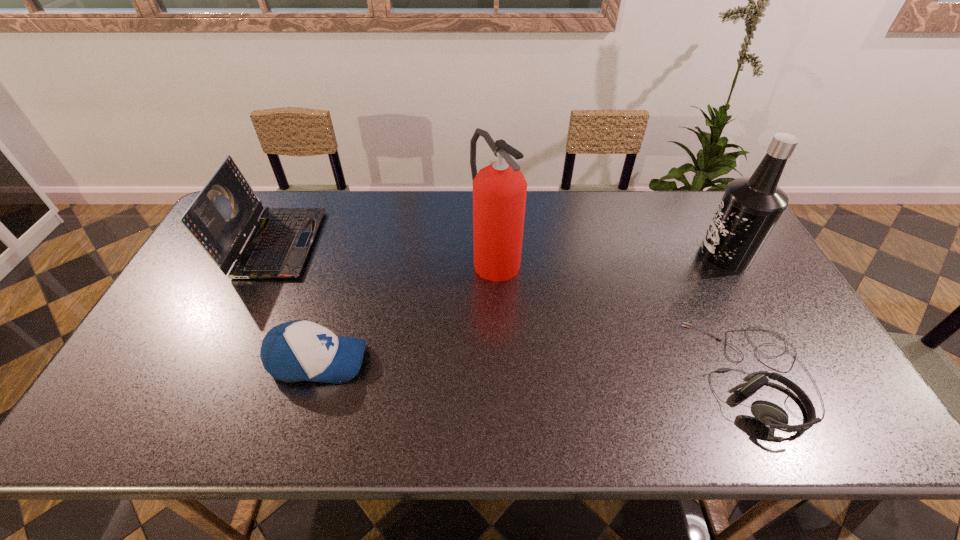
The height and width of the screenshot is (540, 960). I want to click on vacant space positioned on the front label of the liquor, so click(x=572, y=258).

Identify the location of blank space located on the screen of the leftmost object. (343, 243).

I want to click on free point located on the front-facing side of the baseball cap, so click(423, 361).

Find the location of a particular element. This screenshot has height=540, width=960. vacant space located on the outer surface of the headset is located at coordinates (631, 376).

Where is `free location located on the outer surface of the headset`? The height and width of the screenshot is (540, 960). free location located on the outer surface of the headset is located at coordinates (623, 376).

Identify the location of vacant space located on the outer surface of the headset. (614, 376).

Locate an element on the screen. This screenshot has width=960, height=540. fire extinguisher located at the far edge is located at coordinates (499, 190).

At what (x,y) coordinates should I click in order to perform the action: click on laptop computer present at the far edge. Please return your answer as a coordinate pair (x, y). This screenshot has width=960, height=540. Looking at the image, I should click on (222, 216).

Locate an element on the screen. This screenshot has width=960, height=540. object positioned at the near edge is located at coordinates (773, 416).

Find the location of a particular element. This screenshot has width=960, height=540. object that is positioned at the left edge is located at coordinates (222, 216).